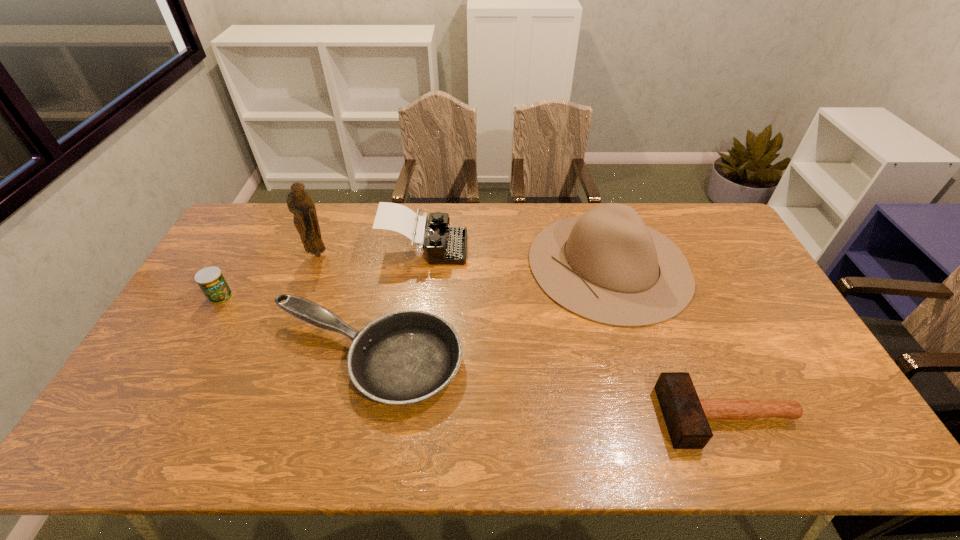
Where is `the tallest object`? This screenshot has width=960, height=540. the tallest object is located at coordinates (300, 203).

Locate an element on the screen. The image size is (960, 540). the fifth shortest object is located at coordinates (607, 266).

Locate an element on the screen. The image size is (960, 540). typewriter is located at coordinates (445, 245).

At what (x,y) coordinates should I click in order to perform the action: click on the leftmost object. Please return your answer as a coordinate pair (x, y). Looking at the image, I should click on (211, 281).

Find the location of a particular element. The height and width of the screenshot is (540, 960). frying pan is located at coordinates (407, 356).

Where is `mallet`? mallet is located at coordinates (686, 416).

Identify the location of free space located on the front-facing side of the figurine. (301, 298).

I want to click on vacant space situated on the front of the sombrero, so point(645,385).

I want to click on free location located on the keys of the fourth shortest object, so click(x=540, y=249).

Locate an element on the screen. This screenshot has width=960, height=540. vacant point located 0.120m on the right of the can is located at coordinates (271, 296).